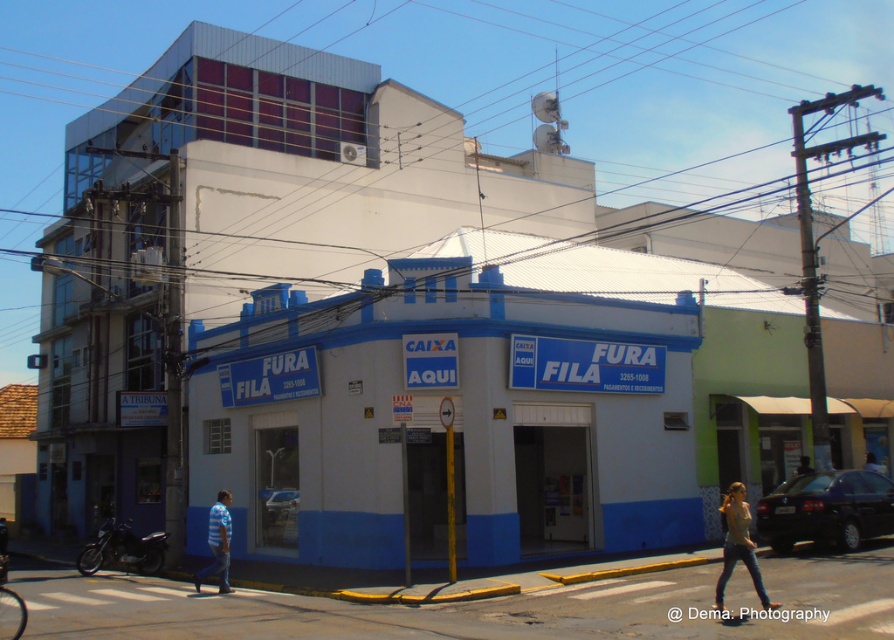
Question: Which of the following is the farthest from the observer?

Choices:
 (A) matte gray tank top at center
 (B) striped shirt at lower left

Answer: (B)

Question: Is matte gray tank top at center positioned at the back of striped shirt at lower left?

Choices:
 (A) yes
 (B) no

Answer: (B)

Question: Does matte gray tank top at center appear on the right side of striped shirt at lower left?

Choices:
 (A) yes
 (B) no

Answer: (A)

Question: Is matte gray tank top at center wider than striped shirt at lower left?

Choices:
 (A) yes
 (B) no

Answer: (B)